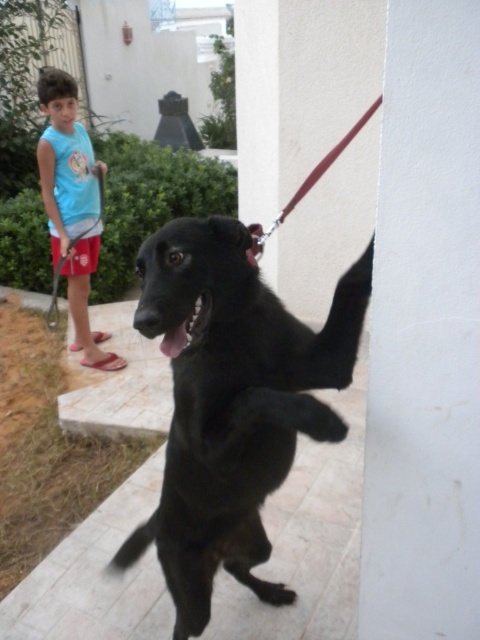
Question: Is the position of white smooth pillar at center less distant than that of leather-like leash at upper center?

Choices:
 (A) yes
 (B) no

Answer: (A)

Question: Is light blue sleeveless shirt at upper left to the right of red leather leash at upper center from the viewer's perspective?

Choices:
 (A) yes
 (B) no

Answer: (B)

Question: Estimate the real-world distances between objects in this image. Which object is farther from the leather-like leash at upper center?

Choices:
 (A) red leather leash at upper center
 (B) white smooth pillar at center

Answer: (B)

Question: Based on their relative distances, which object is farther from the leather-like leash at upper center?

Choices:
 (A) red leather leash at upper center
 (B) light blue sleeveless shirt at upper left
 (C) white smooth pillar at center

Answer: (C)

Question: Is white smooth pillar at center above leather-like leash at upper center?

Choices:
 (A) yes
 (B) no

Answer: (B)

Question: Which of the following is the closest to the observer?

Choices:
 (A) pos(96,170)
 (B) pos(421,492)
 (C) pos(276,452)
 (D) pos(46,115)

Answer: (B)